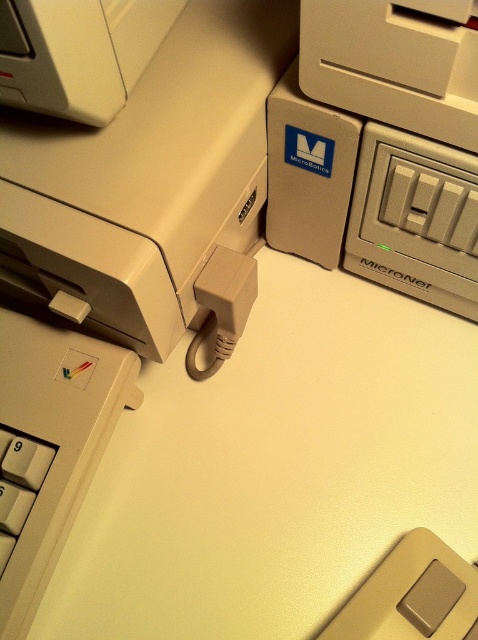
Can you confirm if matte plastic printer at center-left is bigger than white plastic keyboard at lower left?

Yes.

Is the position of matte plastic printer at center-left more distant than that of white plastic keyboard at lower left?

No, matte plastic printer at center-left is in front of white plastic keyboard at lower left.

Locate an element on the screen. matte plastic printer at center-left is located at coordinates (152, 186).

At what (x,y) coordinates should I click in order to perform the action: click on matte plastic printer at center-left. Please return your answer as a coordinate pair (x, y). This screenshot has height=640, width=478. Looking at the image, I should click on (152, 186).

Looking at this image, is white matte table at center further to camera compared to matte plastic printer at center-left?

Yes, it is.

Who is higher up, white matte table at center or matte plastic printer at center-left?

matte plastic printer at center-left is above.

Is point (236, 620) more distant than point (100, 173)?

Yes, point (236, 620) is farther from viewer.

The height and width of the screenshot is (640, 478). I want to click on white matte table at center, so click(239, 464).

Is white plastic keyboard at lower left thinner than matte plastic power outlet at upper right?

Yes, white plastic keyboard at lower left is thinner than matte plastic power outlet at upper right.

Does white plastic keyboard at lower left appear on the left side of matte plastic power outlet at upper right?

Indeed, white plastic keyboard at lower left is positioned on the left side of matte plastic power outlet at upper right.

What do you see at coordinates (50, 445) in the screenshot? I see `white plastic keyboard at lower left` at bounding box center [50, 445].

The height and width of the screenshot is (640, 478). I want to click on white plastic keyboard at lower left, so click(50, 445).